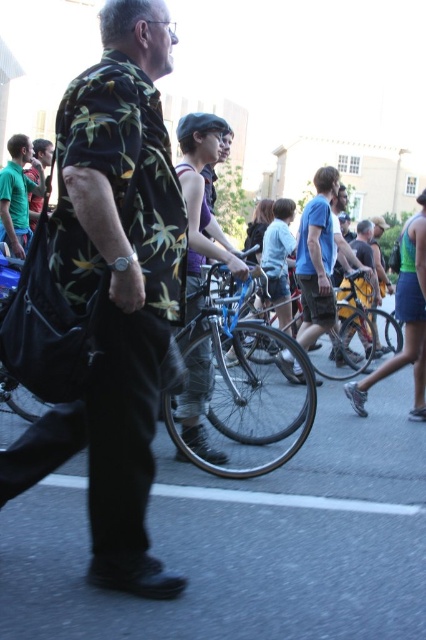
Who is lower down, shiny blue bicycle at center or blue metallic bicycle at center?

blue metallic bicycle at center is below.

Is point (238, 301) closer to viewer compared to point (222, 392)?

Yes, point (238, 301) is closer to viewer.

The height and width of the screenshot is (640, 426). I want to click on shiny blue bicycle at center, so click(244, 388).

The image size is (426, 640). Identify the location of shiny blue bicycle at center. (244, 388).

Consider the image. Does matte purple tank top at center lie behind shiny metallic bicycle at center?

No, matte purple tank top at center is closer to the viewer.

Between point (227, 248) and point (348, 364), which one is positioned behind?

Point (348, 364)

The image size is (426, 640). In order to click on matte purple tank top at center in this screenshot , I will do `click(203, 193)`.

Is printed fabric shirt at center shorter than matte purple tank top at center?

Incorrect, printed fabric shirt at center's height does not fall short of matte purple tank top at center's.

Who is taller, printed fabric shirt at center or matte purple tank top at center?

printed fabric shirt at center

This screenshot has height=640, width=426. In order to click on printed fabric shirt at center in this screenshot , I will do point(106,296).